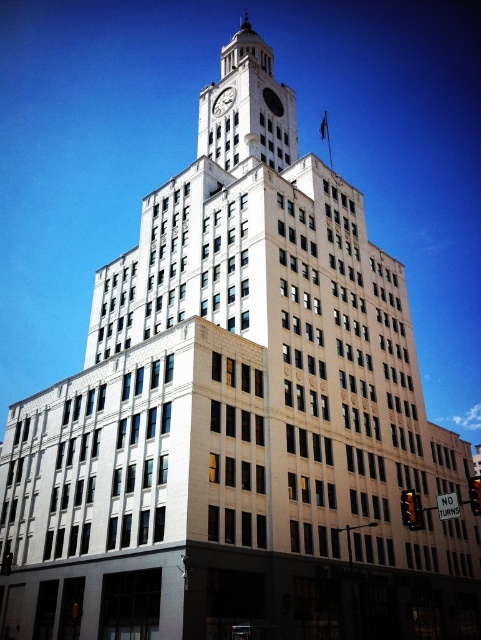
Can you confirm if white stone clock tower at center is smaller than white marble clock at upper center?

Incorrect, white stone clock tower at center is not smaller in size than white marble clock at upper center.

Is white stone clock tower at center wider than white marble clock at upper center?

Correct, the width of white stone clock tower at center exceeds that of white marble clock at upper center.

Who is more forward, (265, 136) or (229, 97)?

Point (265, 136)

Where is `white stone clock tower at center`? white stone clock tower at center is located at coordinates (249, 108).